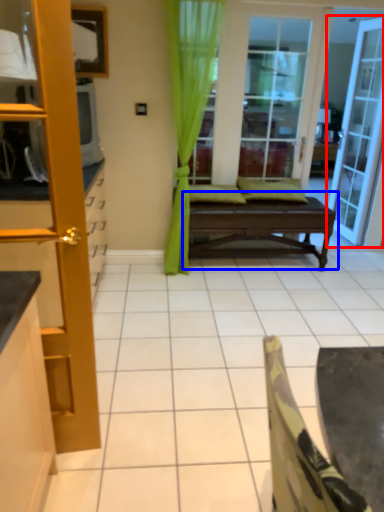
Question: Which object appears closest to the camera in this image, door (highlighted by a red box) or table (highlighted by a blue box)?

Choices:
 (A) door
 (B) table

Answer: (B)